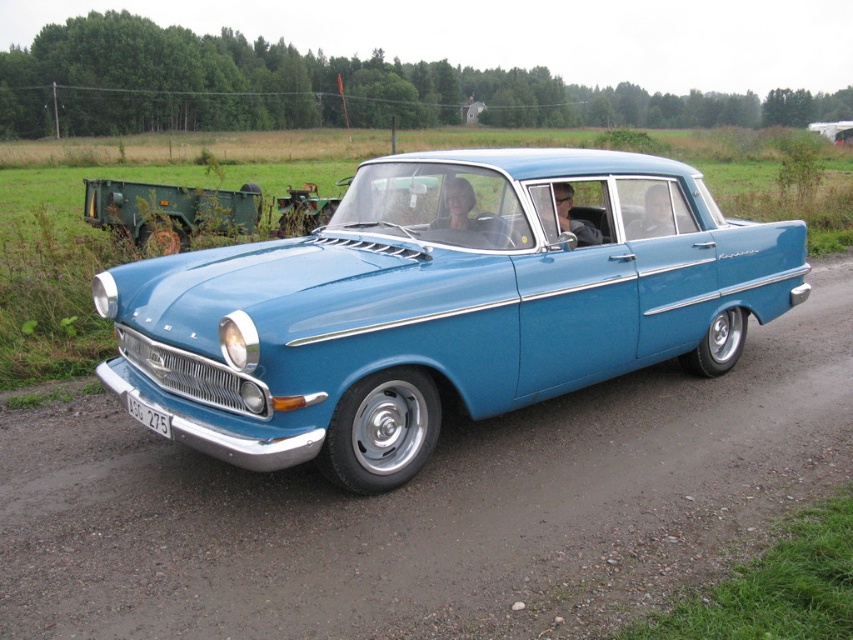
Between dirttrack at center and matte blue car at center, which one is positioned lower?

Positioned lower is dirttrack at center.

Is point (590, 474) positioned in front of point (177, 396)?

No, (590, 474) is further to viewer.

Where is `dirttrack at center`? This screenshot has height=640, width=853. dirttrack at center is located at coordinates (428, 508).

Who is lower down, matte blue car at center or white plastic license plate at lower center?

white plastic license plate at lower center

Where is `matte blue car at center`? This screenshot has width=853, height=640. matte blue car at center is located at coordinates (440, 305).

Between dirttrack at center and white plastic license plate at lower center, which one has more height?

With more height is white plastic license plate at lower center.

Does dirttrack at center have a greater height compared to white plastic license plate at lower center?

Incorrect, dirttrack at center's height is not larger of white plastic license plate at lower center's.

The image size is (853, 640). I want to click on dirttrack at center, so click(x=428, y=508).